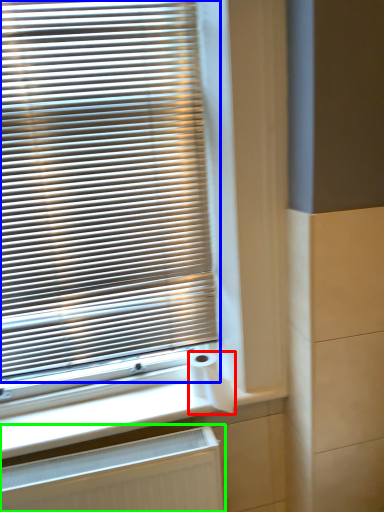
Question: Which object is positioned farthest from toilet paper (highlighted by a red box)? Select from window blind (highlighted by a blue box) and radiator (highlighted by a green box).

Choices:
 (A) window blind
 (B) radiator

Answer: (A)